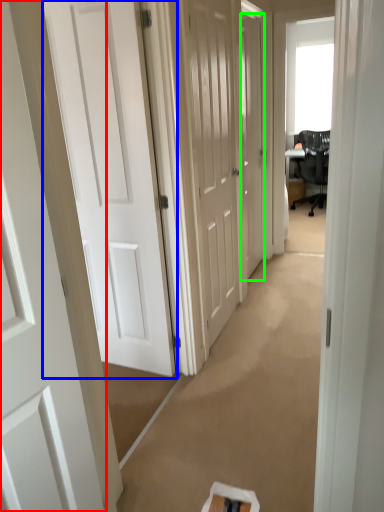
Question: Which is farther away from door (highlighted by a red box)? door (highlighted by a blue box) or door (highlighted by a green box)?

Choices:
 (A) door
 (B) door

Answer: (B)